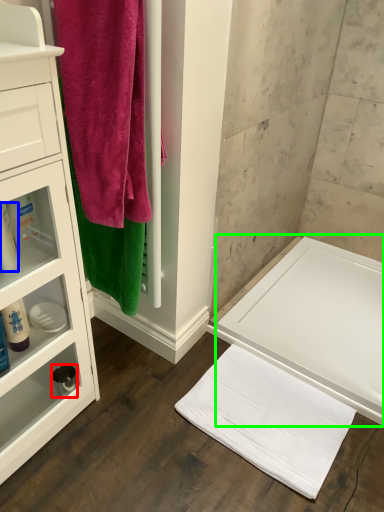
Question: Estimate the real-world distances between objects in this image. Which object is farther from toiletry (highlighted by a red box), toiletry (highlighted by a blue box) or bath (highlighted by a green box)?

Choices:
 (A) toiletry
 (B) bath

Answer: (B)